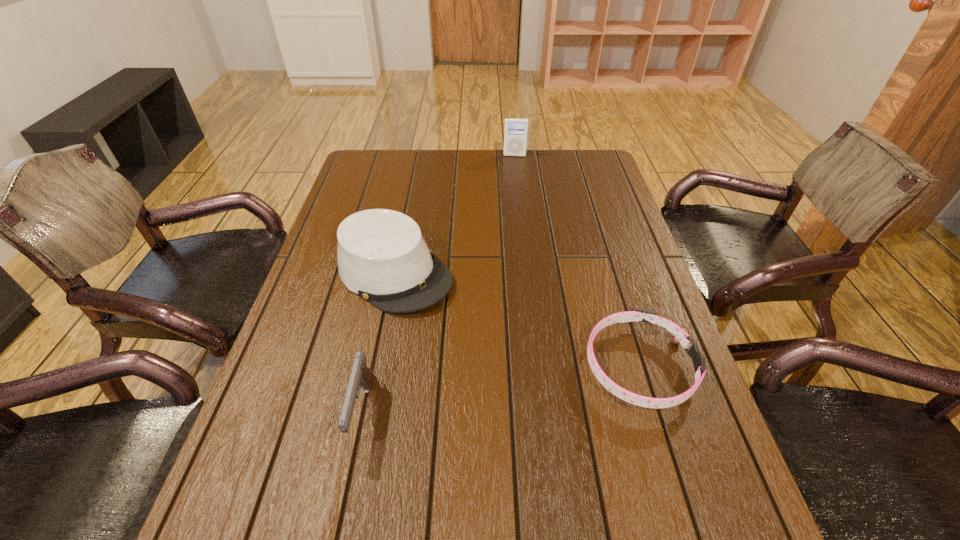
Identify the location of vacant space situated on the front-facing side of the iPod. This screenshot has width=960, height=540. (512, 218).

At what (x,y) coordinates should I click in order to perform the action: click on vacant space located 0.290m on the front-facing side of the iPod. Please return your answer as a coordinate pair (x, y). The width and height of the screenshot is (960, 540). Looking at the image, I should click on (513, 201).

Identify the location of free space located 0.340m on the front-facing side of the iPod. This screenshot has height=540, width=960. (512, 211).

Where is `object located in the far edge section of the desktop`? The height and width of the screenshot is (540, 960). object located in the far edge section of the desktop is located at coordinates (516, 129).

This screenshot has width=960, height=540. I want to click on object that is positioned at the near edge, so click(361, 375).

Locate an element on the screen. The height and width of the screenshot is (540, 960). object that is at the left edge is located at coordinates (382, 256).

Where is `object situated at the right edge`? The width and height of the screenshot is (960, 540). object situated at the right edge is located at coordinates (680, 336).

Image resolution: width=960 pixels, height=540 pixels. Identify the location of free space at the far edge. (485, 168).

You are a GUI agent. You are given a task and a screenshot of the screen. Output one action in this format:
    pyautogui.click(x=<x>, y=<y>)
    Task: Click on the blank space at the near edge of the desktop
    This screenshot has width=960, height=540.
    Given the screenshot: What is the action you would take?
    [587, 448]

Locate an element on the screen. This screenshot has width=960, height=540. vacant point at the left edge is located at coordinates (260, 427).